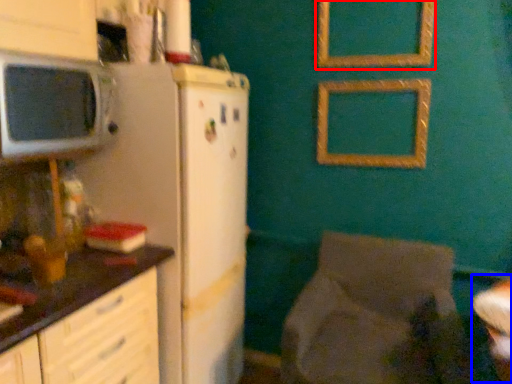
Question: Which of the following is the closest to the observer, picture frame (highlighted by a red box) or table (highlighted by a blue box)?

Choices:
 (A) picture frame
 (B) table

Answer: (B)